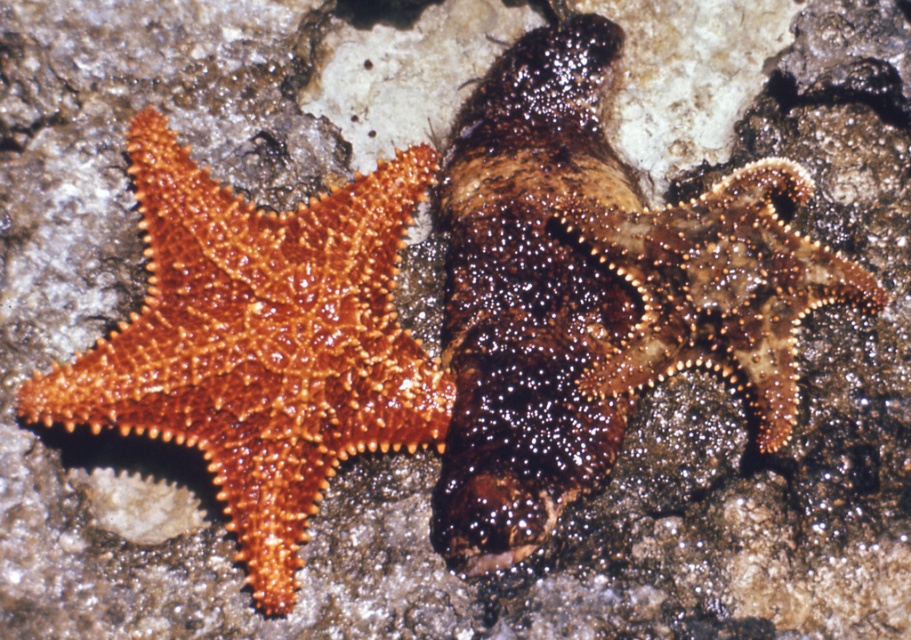
You are a marine biologist examining two starfish on a rocky surface. You notice the shiny brown starfish at center and the brown spiny starfish at center. Which of these two starfish has a greater height?

The shiny brown starfish at center is much taller than the brown spiny starfish at center, so it has a greater height.